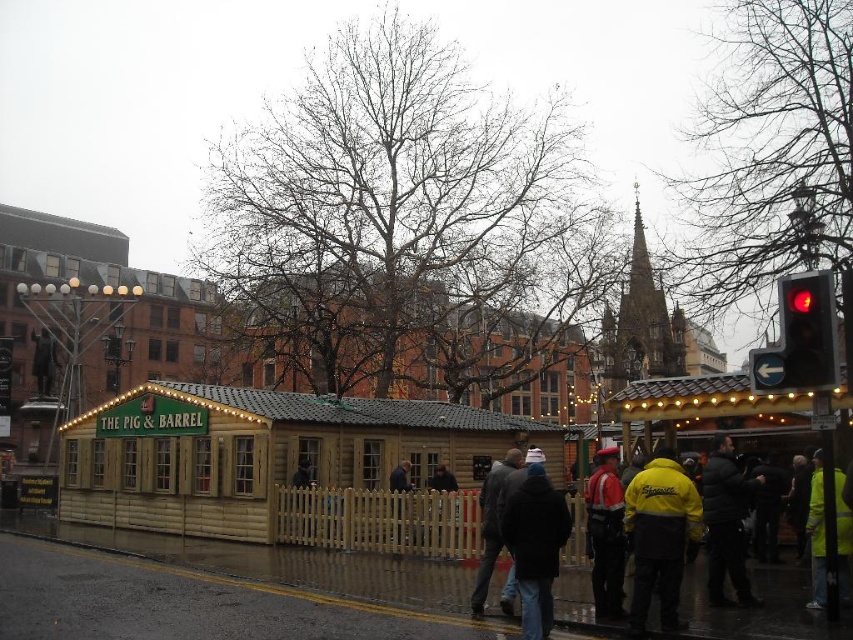
You are planning to set up a temporary food stall in the area between the wooden cabin at center and the yellow fabric tent at center right. Given that your stall requires a space of 3 meters in width, can you determine if there is enough space between them?

The wooden cabin at center is wider than the yellow fabric tent at center right, but the exact width difference isn

You are a delivery person needing to identify the taller jacket between the black puffer jacket at lower right and the yellow reflective jacket at lower right. Which one should you choose?

The black puffer jacket at lower right is taller than the yellow reflective jacket at lower right, so you should choose the black puffer jacket at lower right.